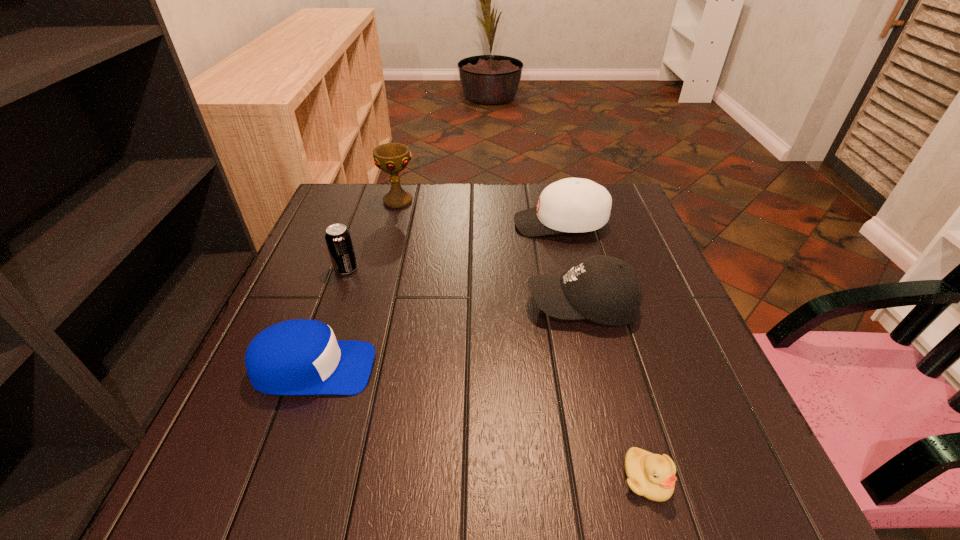
Find the location of a particular element. the tallest object is located at coordinates (392, 158).

The image size is (960, 540). What are the coordinates of `the farthest baseball cap` in the screenshot? It's located at (574, 205).

Identify the location of the second farthest baseball cap. (606, 290).

The height and width of the screenshot is (540, 960). Identify the location of the third farthest object. (338, 239).

At what (x,y) coordinates should I click in order to perform the action: click on the leftmost baseball cap. Please return your answer as a coordinate pair (x, y). Looking at the image, I should click on (295, 357).

The height and width of the screenshot is (540, 960). In order to click on the nearest baseball cap in this screenshot , I will do `click(295, 357)`.

Identify the location of the nearest object. (650, 475).

The height and width of the screenshot is (540, 960). I want to click on duckling, so click(x=650, y=475).

Locate an element on the screen. This screenshot has height=540, width=960. vacant space located on the front of the chalice is located at coordinates (376, 283).

Locate an element on the screen. This screenshot has height=540, width=960. free region located 0.150m on the front-facing side of the farthest baseball cap is located at coordinates (459, 224).